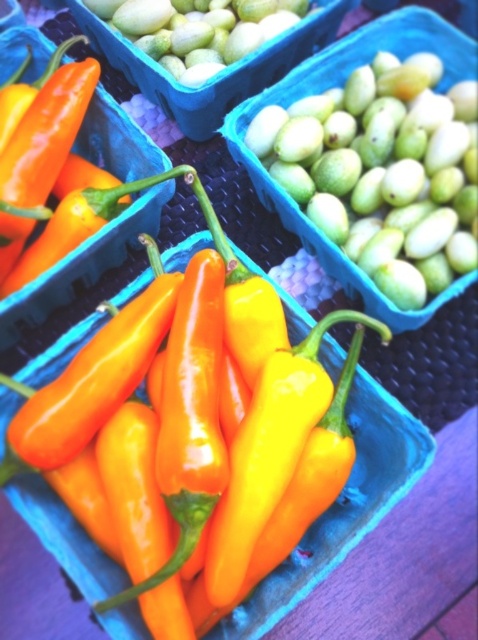
From the picture: Is green matte melon at upper right thinner than green matte melon at upper center?

Yes, green matte melon at upper right is thinner than green matte melon at upper center.

Does green matte melon at upper right appear under green matte melon at upper center?

Yes, green matte melon at upper right is below green matte melon at upper center.

Which is in front, point (425, 132) or point (202, 28)?

Point (425, 132) is more forward.

Identify the location of green matte melon at upper right. The height and width of the screenshot is (640, 478). (372, 179).